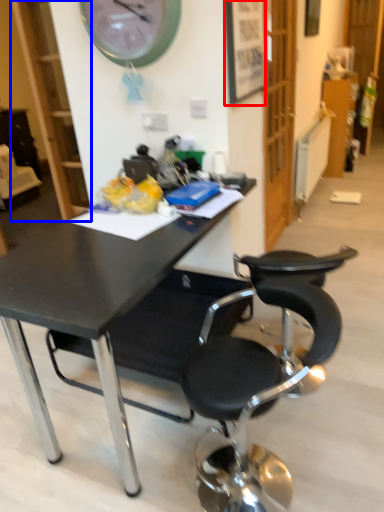
Question: Which object appears closest to the camera in this image, picture frame (highlighted by a red box) or bookshelf (highlighted by a blue box)?

Choices:
 (A) picture frame
 (B) bookshelf

Answer: (A)